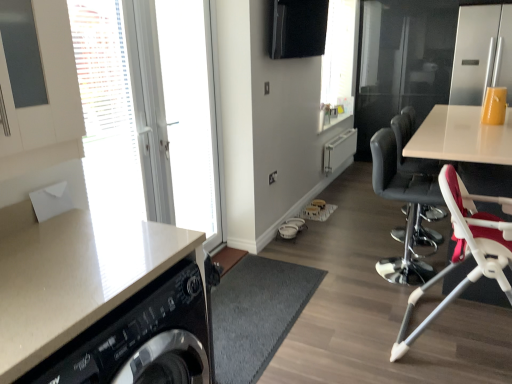
I want to click on space that is in front of black leather chair at right, which appears as the 2th chair when viewed from the front, so click(406, 301).